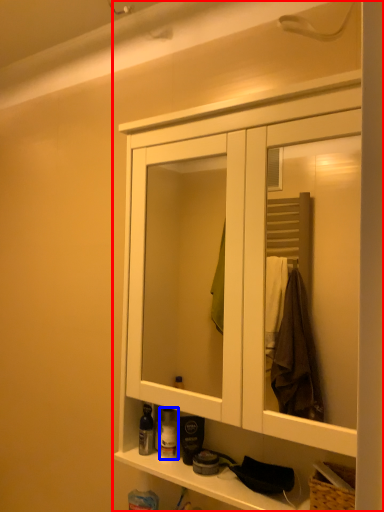
Question: Which object appears farthest to the camera in this image, cabinetry (highlighted by a red box) or toiletry (highlighted by a blue box)?

Choices:
 (A) cabinetry
 (B) toiletry

Answer: (B)